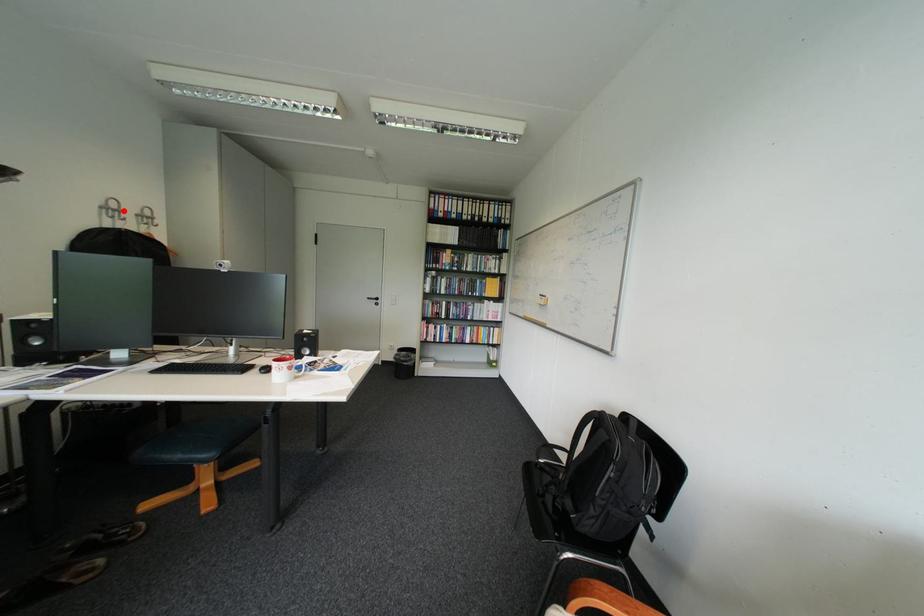
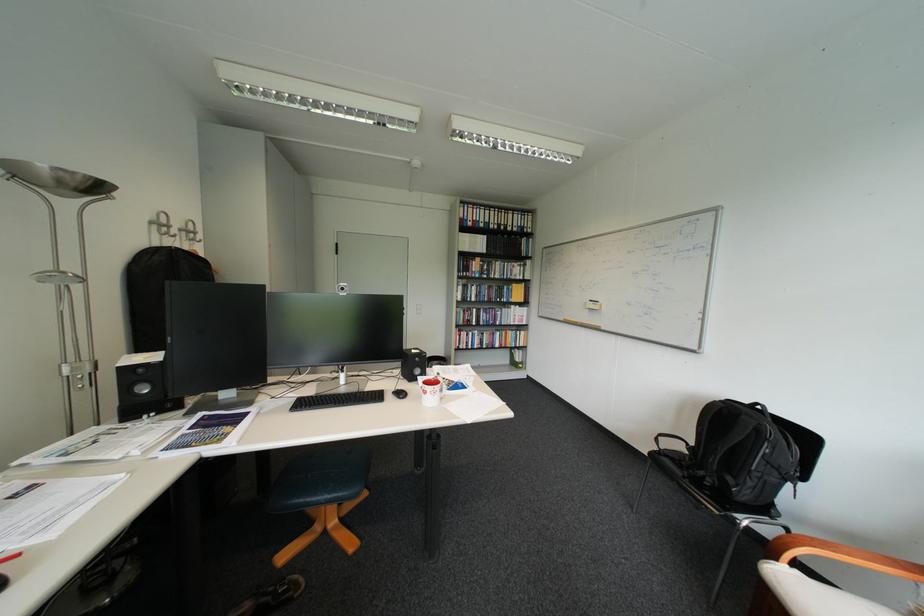
Question: I am providing you with two images of the same scene from different viewpoints. A red point is marked on the first image. Is the red point's position out of view in image 2?

Choices:
 (A) Yes
 (B) No

Answer: (B)